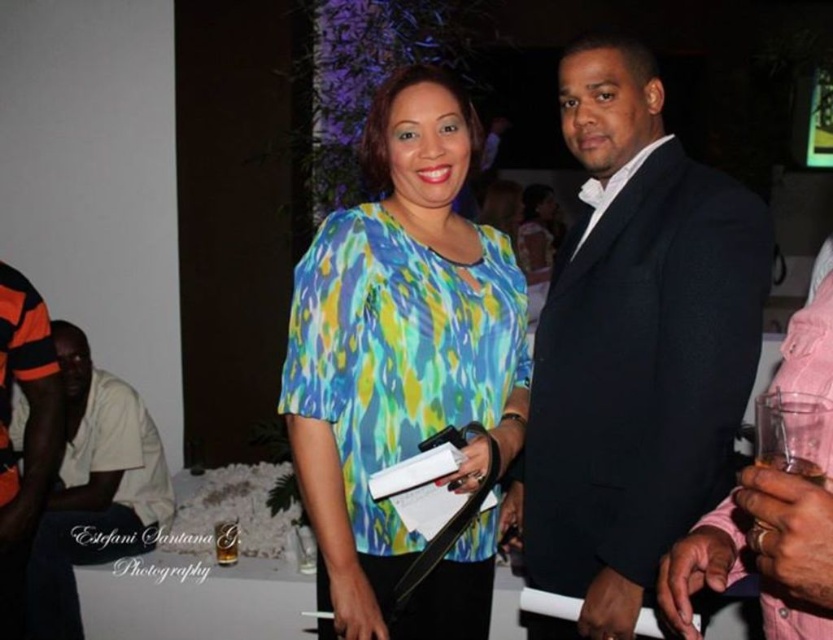
You are attending an indoor event and notice a black wool suit at center. Where exactly is it positioned in the image?

The black wool suit at center is located at point 0.545 on the x axis and 0.761 on the y axis.

Based on the photo, you are an event planner standing at the entrance of the venue and need to locate the black wool suit at center. According to the coordinates provided, where should you look to find it?

The black wool suit at center is located at coordinates point (632, 348), so you should look towards the center of the image to find it.

You are at a party and see two people wearing distinctive clothing. The first is wearing a printed fabric blouse at center, and the second is wearing an orange and black striped shirt at left. From your perspective, which person is positioned more to the right?

The printed fabric blouse at center is positioned more to the right compared to the orange and black striped shirt at left, so the person wearing the printed fabric blouse at center is more to the right.